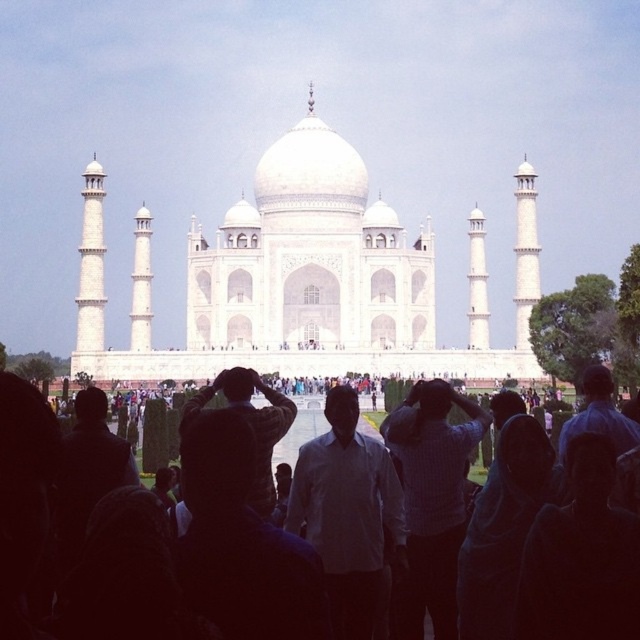
Is white marble taj mahal at center taller than white textured shirt at center?

Yes, white marble taj mahal at center is taller than white textured shirt at center.

Is the position of white marble taj mahal at center more distant than that of white textured shirt at center?

Yes, it is behind white textured shirt at center.

Is point (272, 269) farther from viewer compared to point (436, 465)?

Yes, it is.

The image size is (640, 640). Identify the location of white marble taj mahal at center. (307, 280).

Between matte white people at center and white textured shirt at center, which one appears on the right side from the viewer's perspective?

white textured shirt at center is more to the right.

In the scene shown: Who is positioned more to the left, matte white people at center or white textured shirt at center?

From the viewer's perspective, matte white people at center appears more on the left side.

Where is `matte white people at center`? Image resolution: width=640 pixels, height=640 pixels. matte white people at center is located at coordinates (x=24, y=502).

Between point (524, 163) and point (156, 506), which one is positioned behind?

Positioned behind is point (524, 163).

Who is lower down, white marble taj mahal at center or matte white people at center?

matte white people at center is below.

Consider the image. Measure the distance between white marble taj mahal at center and camera.

white marble taj mahal at center and camera are 368.44 feet apart.

This screenshot has width=640, height=640. Find the location of `white marble taj mahal at center`. white marble taj mahal at center is located at coordinates (307, 280).